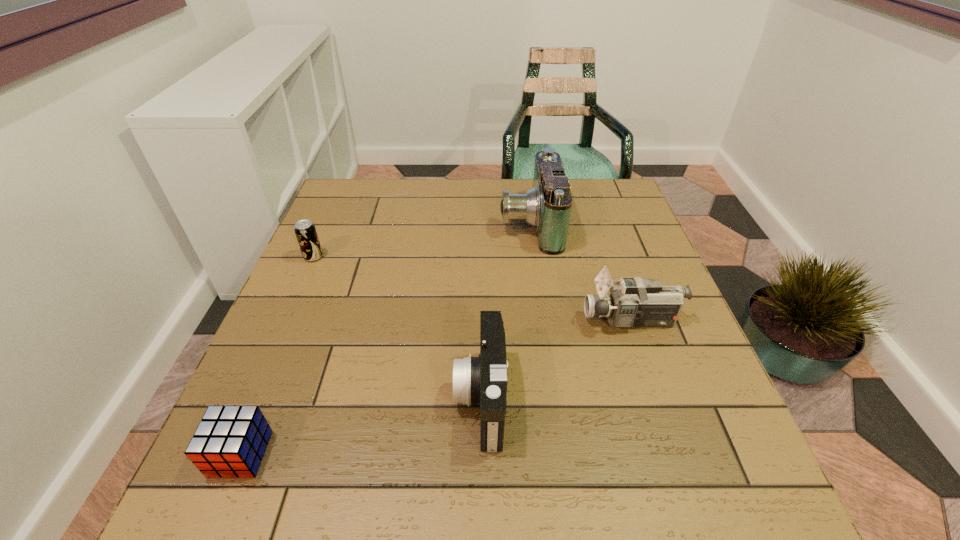
I want to click on free space between the second nearest camcorder and the tallest object, so click(580, 272).

The image size is (960, 540). I want to click on vacant area between the second shortest object and the rightmost object, so click(472, 288).

Locate which object ranks fourth in proximity to the rightmost object. Please provide its 2D coordinates. Your answer should be formatted as a tuple, i.e. [(x, y)], where the tuple contains the x and y coordinates of a point satisfying the conditions above.

[(305, 231)]

Select which object appears as the third closest to the tallest camcorder. Please provide its 2D coordinates. Your answer should be formatted as a tuple, i.e. [(x, y)], where the tuple contains the x and y coordinates of a point satisfying the conditions above.

[(305, 231)]

You are a GUI agent. You are given a task and a screenshot of the screen. Output one action in this format:
    pyautogui.click(x=<x>, y=<y>)
    Task: Click on the closest camcorder relative to the tallest object
    The image size is (960, 540).
    Given the screenshot: What is the action you would take?
    pyautogui.click(x=635, y=302)

Locate an element on the screen. The image size is (960, 540). camcorder that stands as the second closest to the fourth tallest object is located at coordinates (547, 206).

Where is `vacant space that satisfies the following two spatial constraints: 1. on the front-facing side of the tallest object; 2. on the front side of the soda can`? The height and width of the screenshot is (540, 960). vacant space that satisfies the following two spatial constraints: 1. on the front-facing side of the tallest object; 2. on the front side of the soda can is located at coordinates (534, 257).

The height and width of the screenshot is (540, 960). I want to click on free space that satisfies the following two spatial constraints: 1. on the front side of the cube; 2. on the right side of the second shortest object, so click(227, 454).